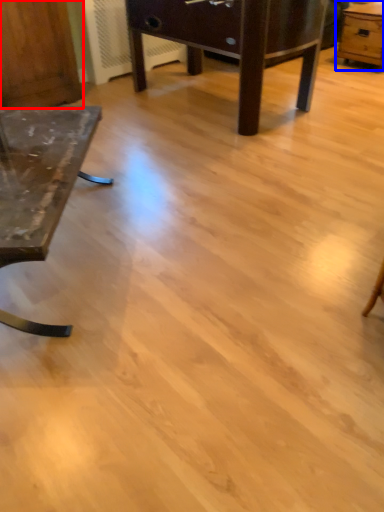
Question: Among these objects, which one is nearest to the camera, dresser (highlighted by a red box) or table (highlighted by a blue box)?

Choices:
 (A) dresser
 (B) table

Answer: (A)